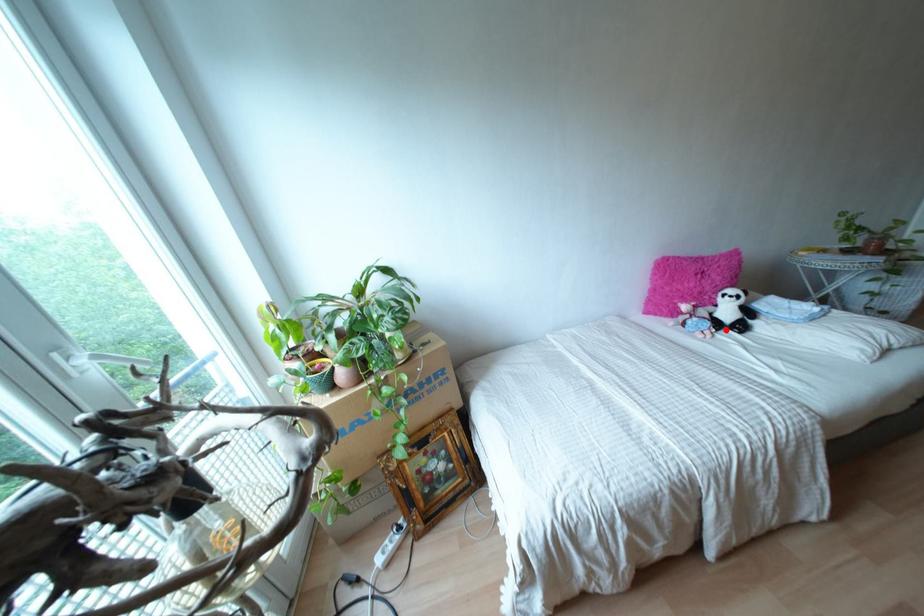
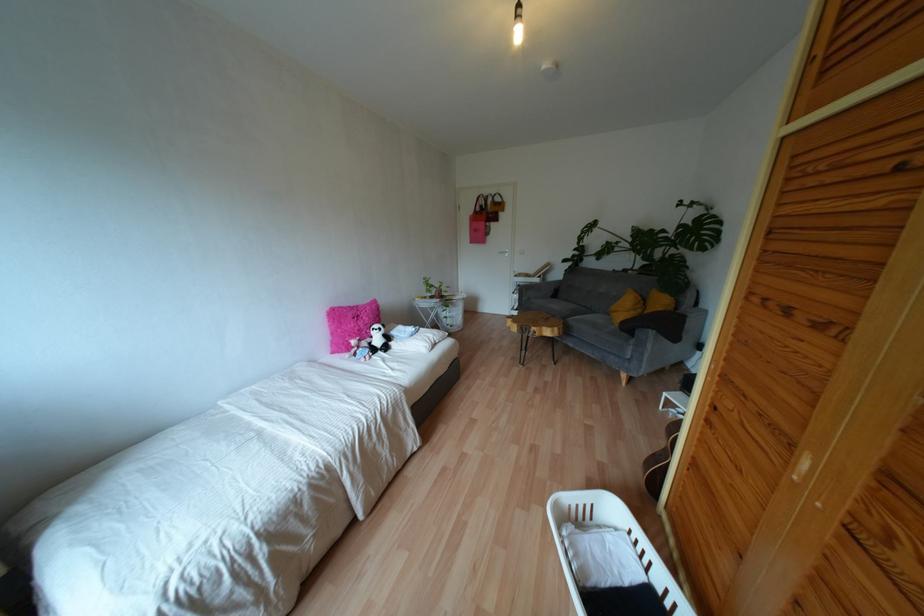
Question: A red point is marked in image1. In image2, is the corresponding 3D point closer to the camera or farther? Reply with the corresponding letter.

Choices:
 (A) The corresponding 3D point is closer.
 (B) The corresponding 3D point is farther.

Answer: (B)